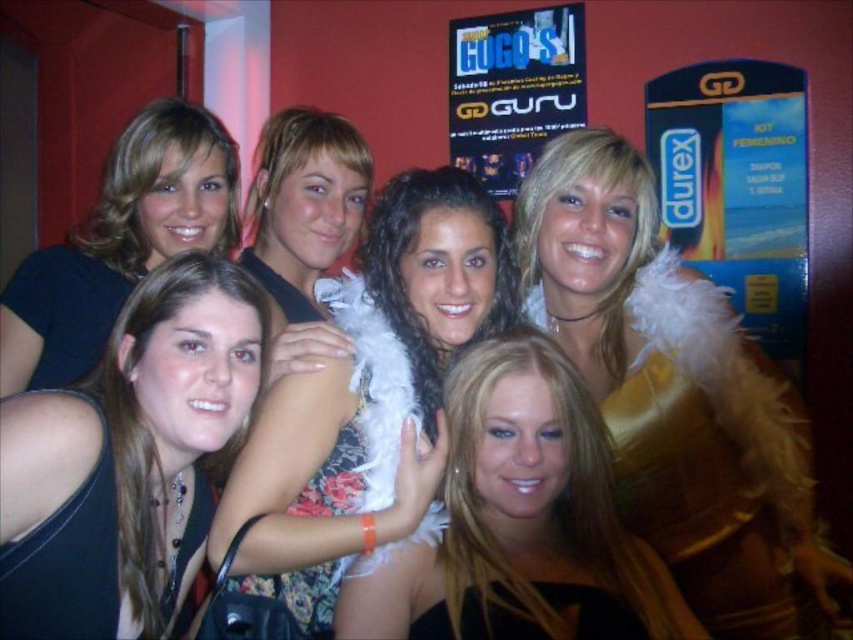
You are at a party and want to take a photo with the gold shiny feather boa at upper center and the fluffy white boa at center. Which boa should you choose if you want the one that is wider?

The gold shiny feather boa at upper center is wider than the fluffy white boa at center, so choose the gold shiny feather boa at upper center.

You are at a party and want to take a photo with the fluffy white boa at center and the black fabric dress at center. If you stand to the left of the dress, will the boa be on your right side?

Yes, the fluffy white boa at center is to the right of the black fabric dress at center. If you stand to the left of the dress, the boa will be on your right side.